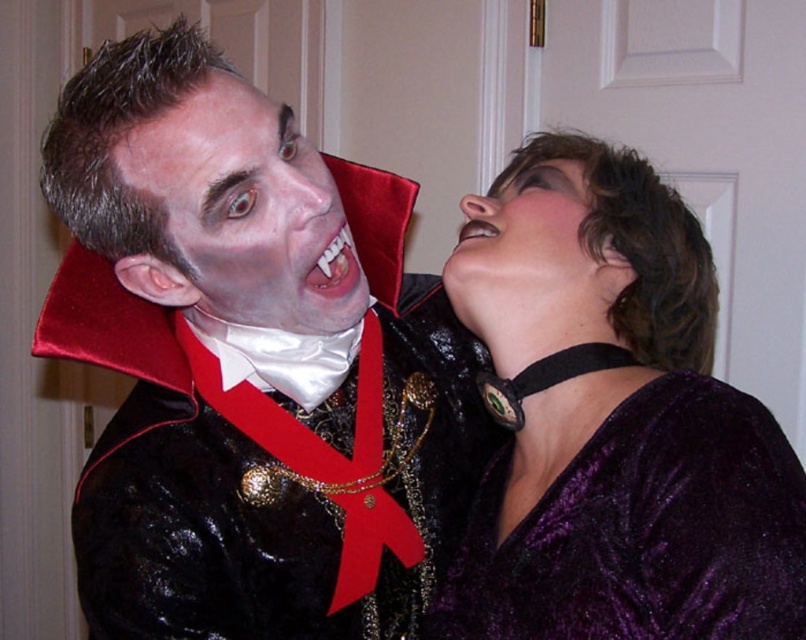
You are a costume designer preparing for a play. You need to ensure that the velvet black jacket at center and the velvet purple dress at upper right can fit side by side on a mannequin stand that is 1.2 meters wide. Based on the image, will they both fit?

The velvet black jacket at center is wider than the velvet purple dress at upper right. However, since the total width of both items combined is not specified, it is uncertain if they will fit on the 1.2 meters wide mannequin stand. More information is needed to determine the exact widths of each item.

You are a costume designer who needs to adjust the placement of the velvet purple choker at upper right so that it is closer to the viewer by 3 inches. What should the new distance be?

The velvet purple choker at upper right is currently 23.94 inches away from the viewer. To move it closer by 3 inches, subtract 3 from 23.94, resulting in a new distance of 20.94 inches.

You are a photographer setting up a shoot with two models wearing the velvet black jacket at center and the velvet purple dress at upper right. The minimum distance required between the models for proper lighting is 8 inches. Based on their current positions, can they maintain the required distance?

The velvet black jacket at center is 7.69 inches from velvet purple dress at upper right. Since the required distance is 8 inches, they are currently 0.31 inches too close to meet the lighting requirement.